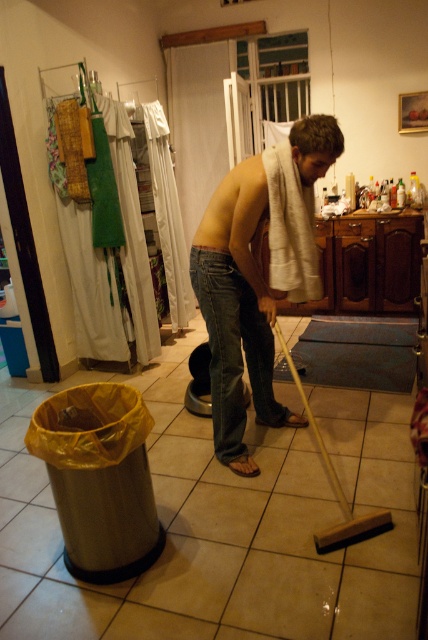
Based on the photo, you are standing in the kitchen and need to reach the shiny white towel at center. There is a man in denim jeans at center blocking your path. Can you walk around him to the left side to get to the towel?

The shiny white towel at center is to the right of denim jeans at center, so you can walk around the man to the left side to reach the towel.

From the picture: You are standing at point (202, 250) and want to walk to the door located at point (225, 433). Is there a clear path between these two points without any obstacles?

Point (225, 433) is behind point (202, 250), so there might be an obstacle blocking the path between them. You may need to move around or check for a clear route.